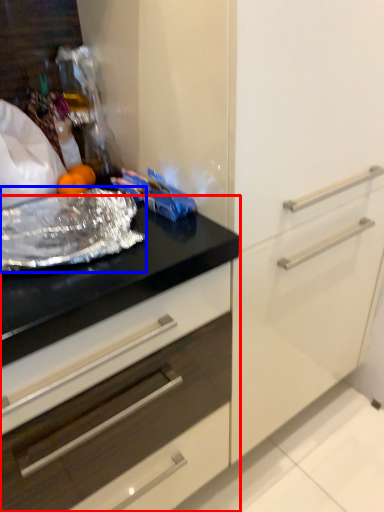
Question: Which point is closer to the camera, countertop (highlighted by a red box) or material (highlighted by a blue box)?

Choices:
 (A) countertop
 (B) material

Answer: (A)